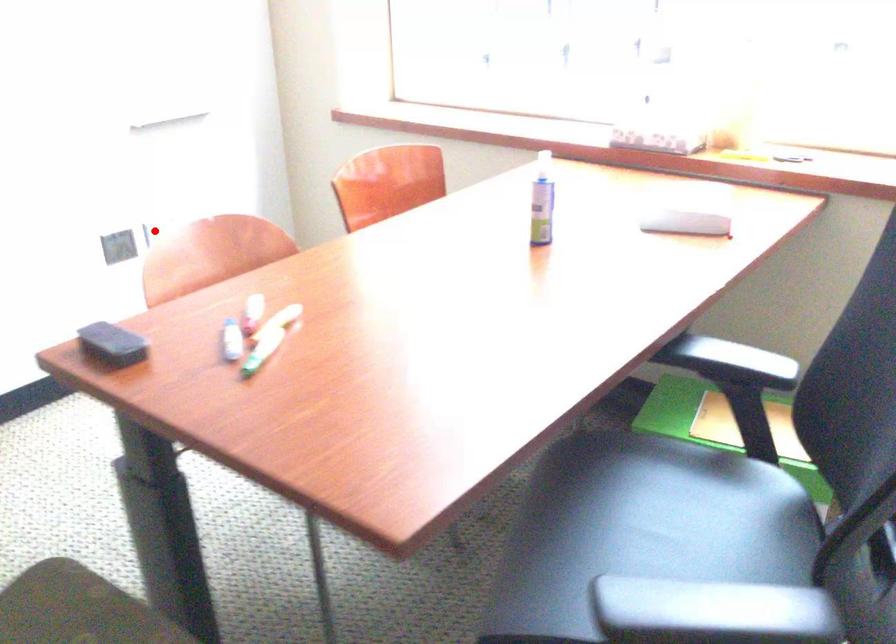
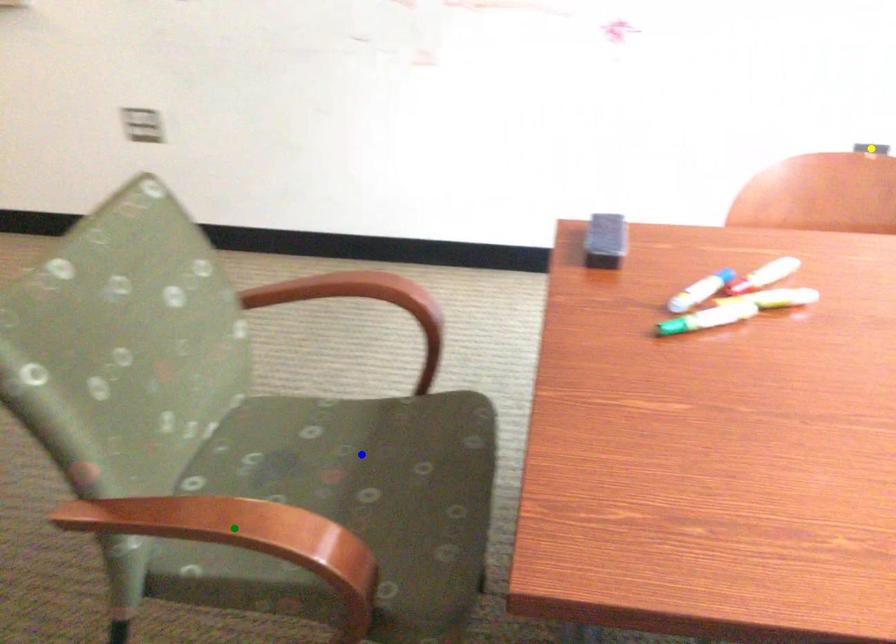
Question: I am providing you with two images of the same scene from different viewpoints. A red point is marked on the first image. You are given multiple points on the second image. Which spot in image 2 lines up with the point in image 1?

Choices:
 (A) yellow point
 (B) blue point
 (C) green point

Answer: (A)